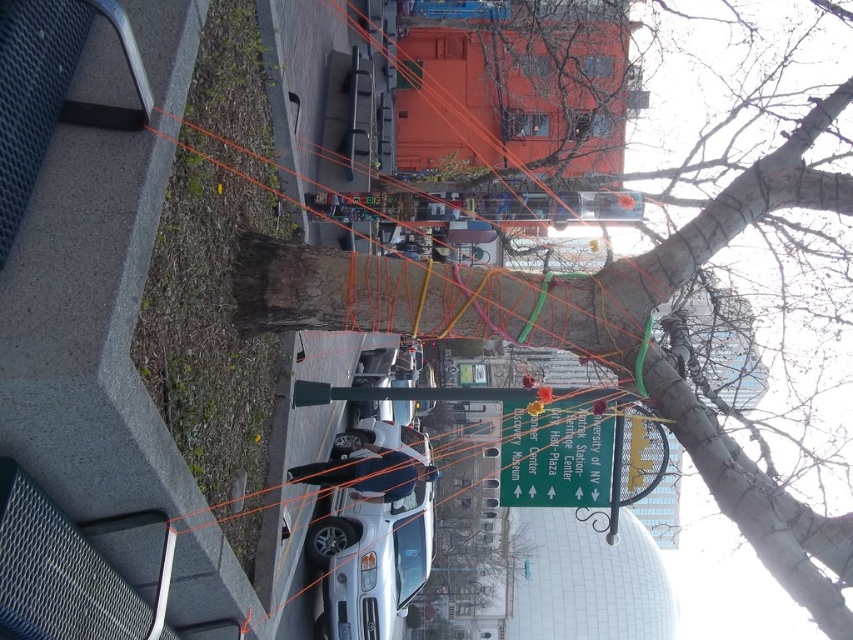
Question: Is white matte car at center in front of green glossy street sign at center?

Choices:
 (A) yes
 (B) no

Answer: (B)

Question: Among these points, which one is farthest from the camera?

Choices:
 (A) (527, 488)
 (B) (666, 404)
 (C) (415, 595)

Answer: (C)

Question: Which point is closer to the camera taking this photo?

Choices:
 (A) (599, 436)
 (B) (822, 620)

Answer: (B)

Question: Is white matte car at center to the left of green glossy street sign at center from the viewer's perspective?

Choices:
 (A) yes
 (B) no

Answer: (A)

Question: Is bark textured tree at center behind white matte car at center?

Choices:
 (A) yes
 (B) no

Answer: (B)

Question: Which point appears closest to the camera in this image?

Choices:
 (A) (518, 429)
 (B) (753, 499)
 (C) (315, 540)

Answer: (B)